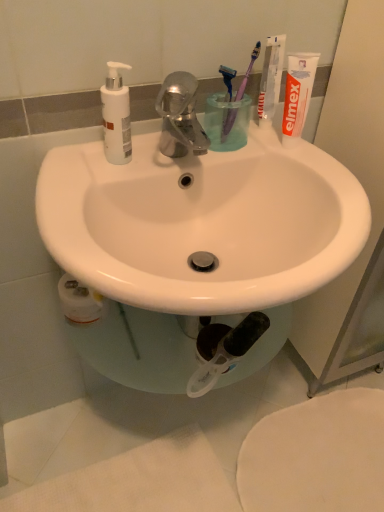
Question: Does point (231, 125) appear closer or farther from the camera than point (228, 118)?

Choices:
 (A) farther
 (B) closer

Answer: (B)

Question: Is purple plastic toothbrush at upper right, which ranks as the 1th toothbrush in right-to-left order, to the left or to the right of transparent plastic cup at center in the image?

Choices:
 (A) right
 (B) left

Answer: (A)

Question: Considering the real-world distances, which object is farthest from the purple plastic toothbrush at upper right, which is the 2th toothbrush from right to left?

Choices:
 (A) white glossy sink at center
 (B) white glossy toothpaste at upper right, the first toothpaste viewed from the left
 (C) white matte tube of toothpaste at upper right, the first toothpaste when ordered from right to left
 (D) transparent plastic cup at center
 (E) white matte pump bottle at upper left

Answer: (A)

Question: Estimate the real-world distances between objects in this image. Which object is closer to the white glossy sink at center?

Choices:
 (A) white glossy toothpaste at upper right, the first toothpaste viewed from the left
 (B) purple plastic toothbrush at upper right, the second toothbrush viewed from the left
 (C) white matte pump bottle at upper left
 (D) white matte tube of toothpaste at upper right, which is the second toothpaste in left-to-right order
 (E) transparent plastic cup at center

Answer: (E)